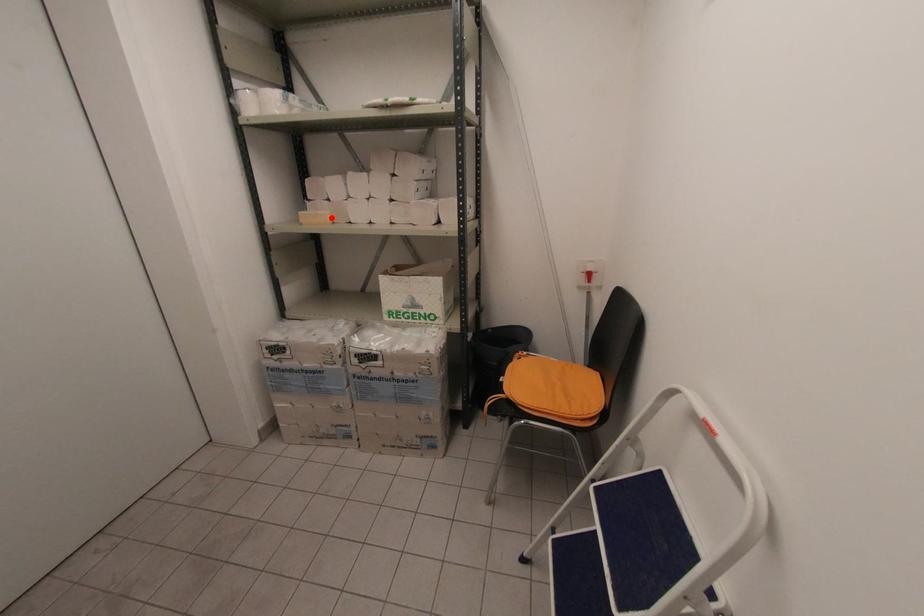
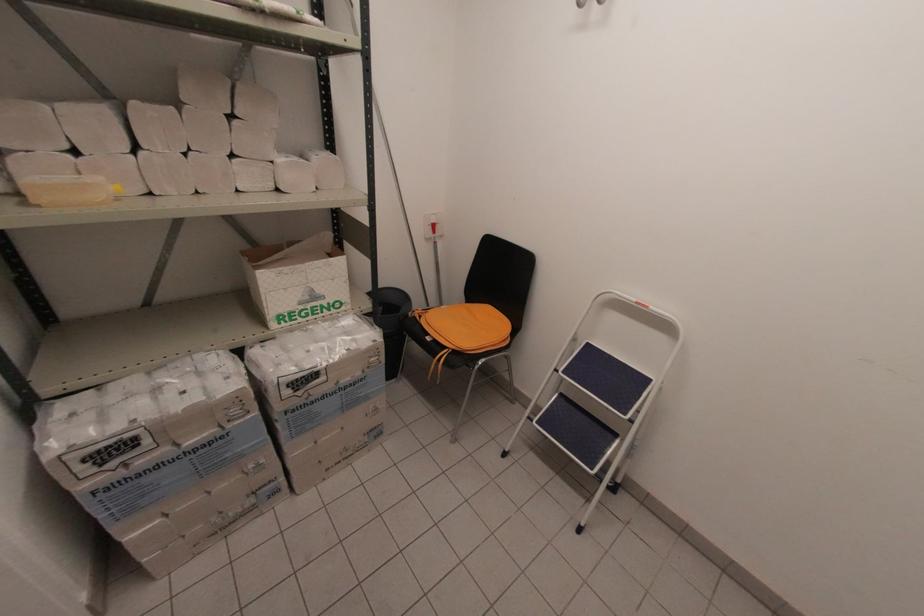
In the second image, find the point that corresponds to the highlighted location in the first image.

(116, 188)